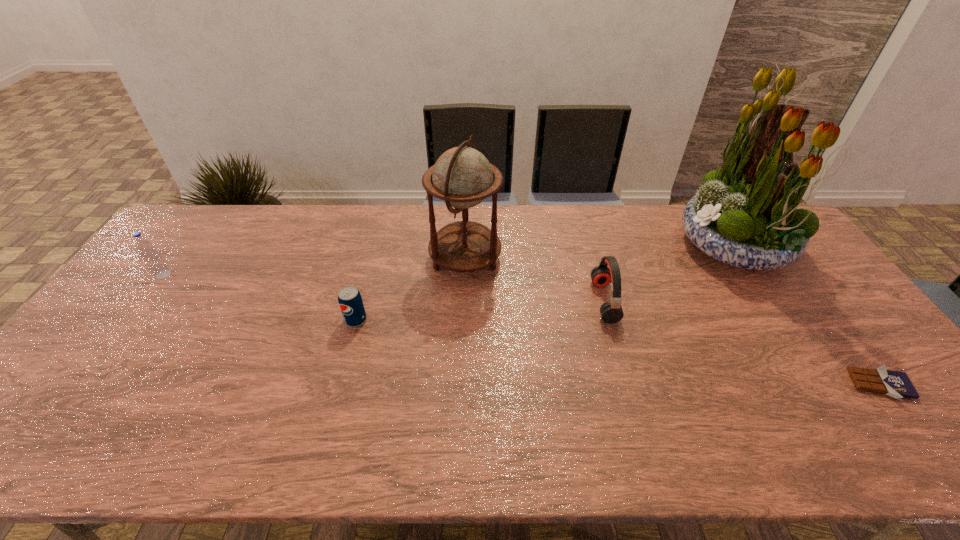
Point out which object is positioned as the fifth nearest to the leftmost object. Please provide its 2D coordinates. Your answer should be formatted as a tuple, i.e. [(x, y)], where the tuple contains the x and y coordinates of a point satisfying the conditions above.

[(896, 384)]

At what (x,y) coordinates should I click in order to perform the action: click on free region that satisfies the following two spatial constraints: 1. on the front side of the fifth tallest object; 2. on the left side of the shortest object. Please return your answer as a coordinate pair (x, y). This screenshot has width=960, height=540. Looking at the image, I should click on (339, 385).

Where is `free space that satisfies the following two spatial constraints: 1. on the ear cups of the nearest object; 2. on the left side of the earphone`? This screenshot has height=540, width=960. free space that satisfies the following two spatial constraints: 1. on the ear cups of the nearest object; 2. on the left side of the earphone is located at coordinates (627, 385).

At what (x,y) coordinates should I click in order to perform the action: click on vacant point that satisfies the following two spatial constraints: 1. on the front side of the shortest object; 2. on the right side of the water bottle. Please return your answer as a coordinate pair (x, y). This screenshot has width=960, height=540. Looking at the image, I should click on (81, 385).

Image resolution: width=960 pixels, height=540 pixels. I want to click on free point that satisfies the following two spatial constraints: 1. on the front-facing side of the tallest object; 2. on the left side of the nearest object, so click(x=825, y=385).

In order to click on free location that satisfies the following two spatial constraints: 1. on the surface of the fourth object from right to left; 2. on the right side of the nearest object in this screenshot , I will do `click(461, 385)`.

Where is `free space that satisfies the following two spatial constraints: 1. on the front side of the second shortest object; 2. on the left side of the leftmost object`? This screenshot has width=960, height=540. free space that satisfies the following two spatial constraints: 1. on the front side of the second shortest object; 2. on the left side of the leftmost object is located at coordinates (129, 320).